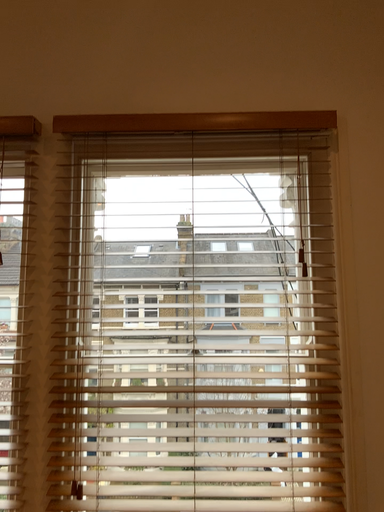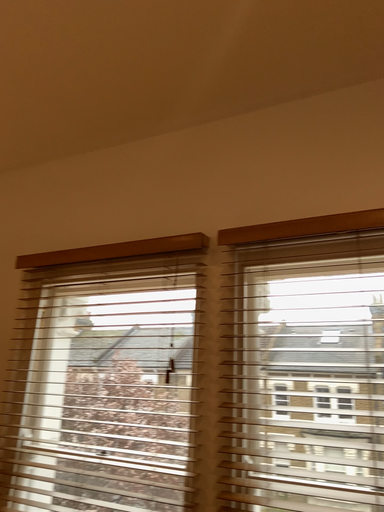
Question: How did the camera likely rotate when shooting the video?

Choices:
 (A) rotated left
 (B) rotated right

Answer: (A)